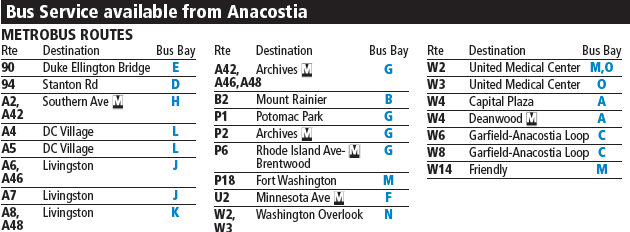
Locate an element on the screen. This screenshot has height=232, width=630. columns is located at coordinates (2, 52), (67, 51), (176, 46), (226, 55), (293, 41), (394, 51), (435, 53), (493, 45), (598, 55).